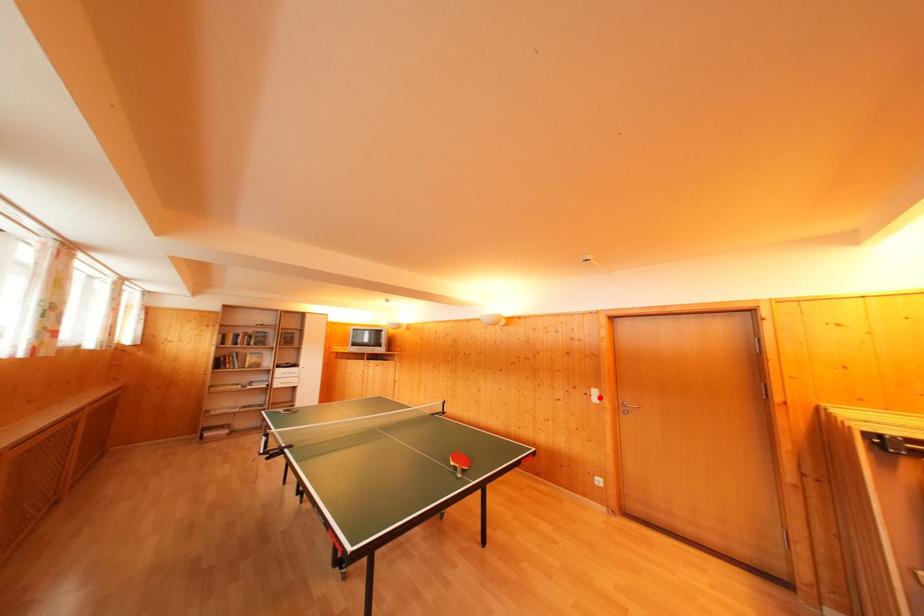
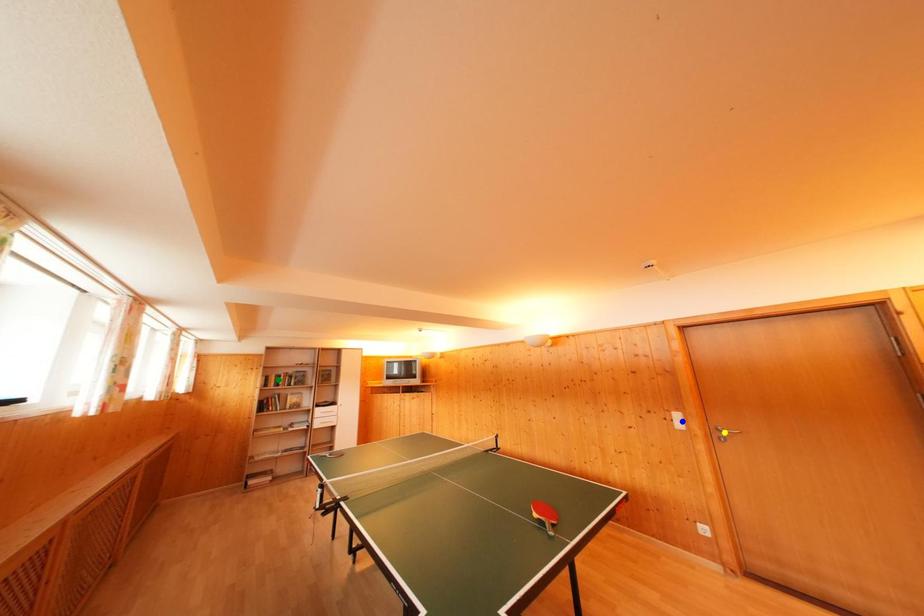
Question: I am providing you with two images of the same scene from different viewpoints. A red point is marked on the first image. You are given multiple points on the second image. Which point in image 2 represents the same 3d spot as the red point in image 1?

Choices:
 (A) blue point
 (B) yellow point
 (C) green point

Answer: (A)